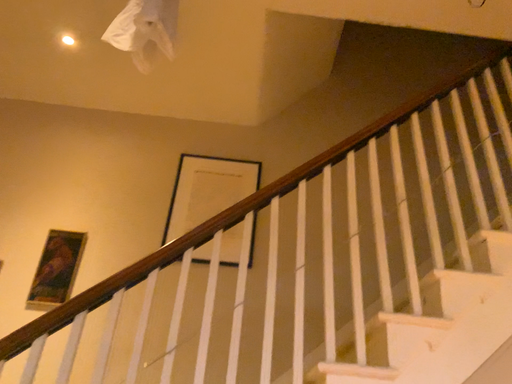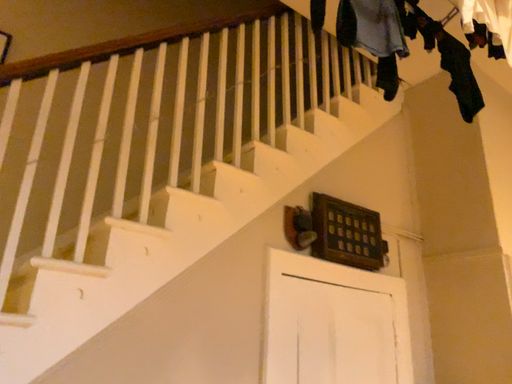
Question: How did the camera likely rotate when shooting the video?

Choices:
 (A) rotated upward
 (B) rotated downward

Answer: (B)